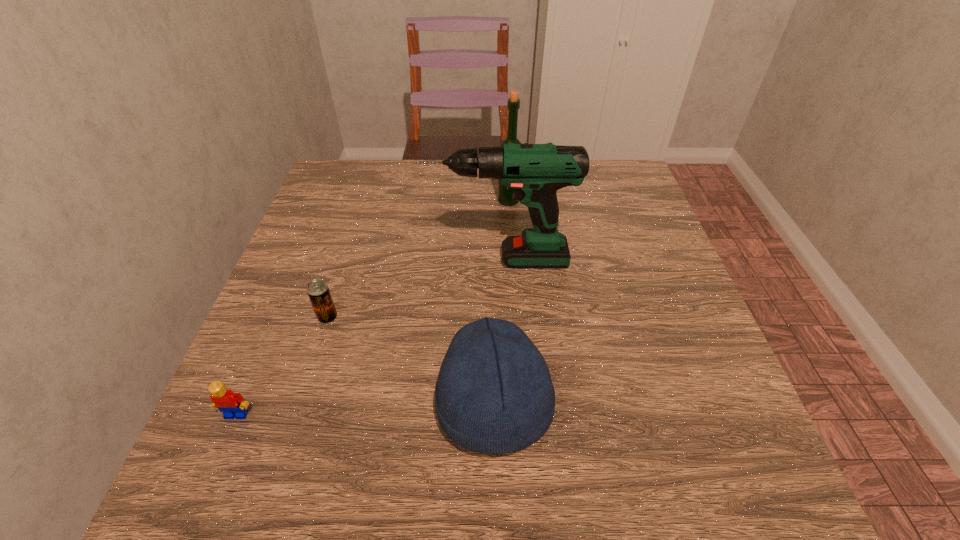
Locate an element on the screen. This screenshot has height=540, width=960. vacant space at the far left corner is located at coordinates (356, 185).

This screenshot has height=540, width=960. In the image, there is a desktop. Find the location of `free region at the far right corner`. free region at the far right corner is located at coordinates (613, 209).

Find the location of a particular element. The width and height of the screenshot is (960, 540). free region at the near right corner of the desktop is located at coordinates (740, 451).

Find the location of a particular element. unoccupied position between the beer can and the second farthest object is located at coordinates (412, 288).

I want to click on vacant space that's between the skullcap and the farthest object, so click(x=501, y=303).

Find the location of a particular element. free area in between the drill and the farthest object is located at coordinates (503, 230).

You are a GUI agent. You are given a task and a screenshot of the screen. Output one action in this format:
    pyautogui.click(x=<x>, y=<y>)
    Task: Click on the vacant space that is in between the liquor and the beer can
    
    Given the screenshot: What is the action you would take?
    pyautogui.click(x=419, y=259)

Locate an element on the screen. The image size is (960, 540). free space that is in between the farthest object and the beer can is located at coordinates (419, 259).

Identify the location of free space between the beer can and the skullcap. The width and height of the screenshot is (960, 540). (411, 361).

Identify the location of empty location between the leftmost object and the third farthest object. [282, 366].